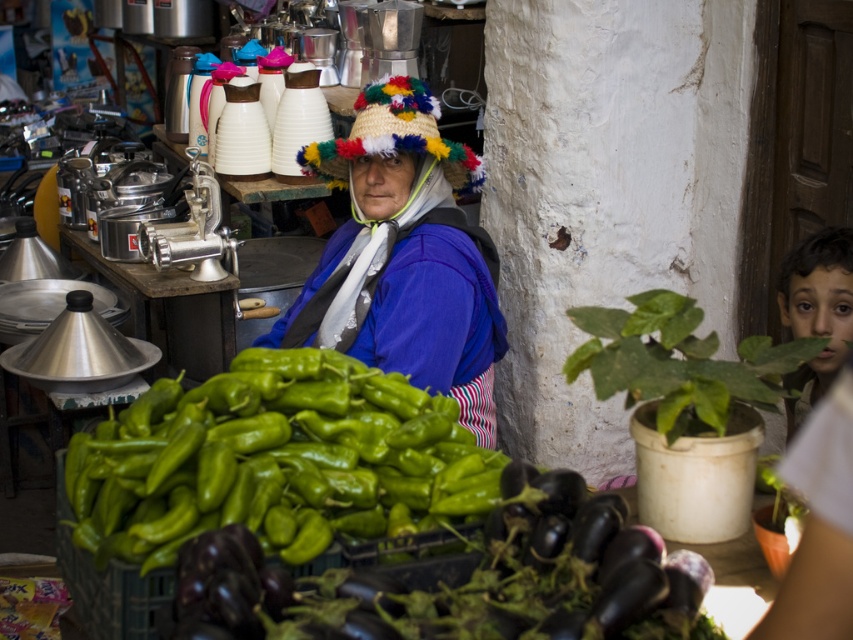
Question: Does green matte peppers at lower left come in front of knitted woolen hat at center?

Choices:
 (A) yes
 (B) no

Answer: (A)

Question: Based on their relative distances, which object is farther from the green matte peppers at lower left?

Choices:
 (A) brown hair at right
 (B) green matte eggplant at center
 (C) knitted woolen hat at center

Answer: (A)

Question: Which of the following is the farthest from the observer?

Choices:
 (A) knitted woolen hat at center
 (B) green matte peppers at lower left
 (C) brown hair at right
 (D) green matte eggplant at center

Answer: (A)

Question: Does green matte peppers at lower left appear on the left side of green matte eggplant at center?

Choices:
 (A) yes
 (B) no

Answer: (A)

Question: Is green matte eggplant at center smaller than brown hair at right?

Choices:
 (A) yes
 (B) no

Answer: (B)

Question: Which object is the closest to the green matte eggplant at center?

Choices:
 (A) brown hair at right
 (B) knitted woolen hat at center

Answer: (A)